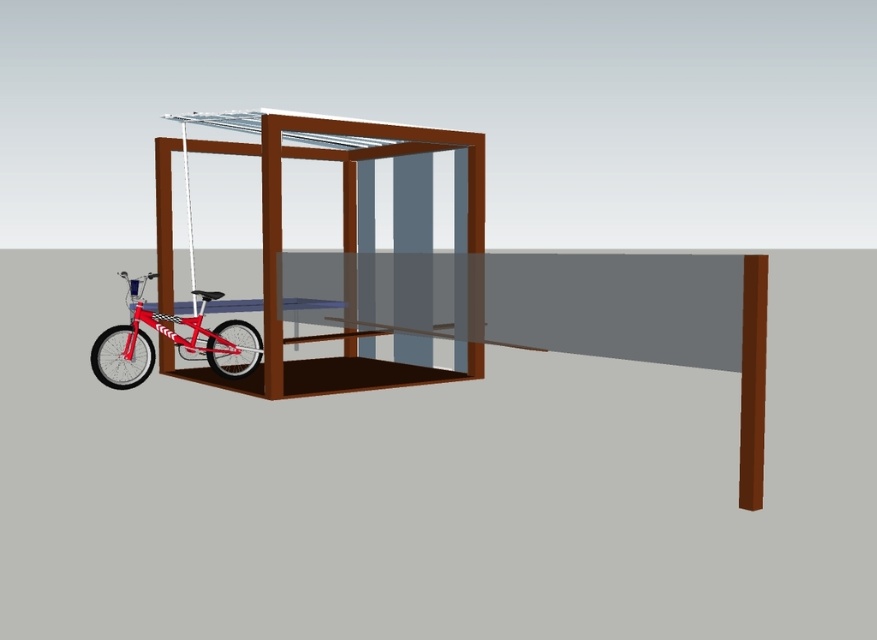
Question: In this image, where is brown matte gazebo at left located relative to shiny red bicycle at left?

Choices:
 (A) below
 (B) above

Answer: (B)

Question: Observing the image, what is the correct spatial positioning of brown matte gazebo at left in reference to shiny red bicycle at left?

Choices:
 (A) above
 (B) below

Answer: (A)

Question: Among these points, which one is farthest from the camera?

Choices:
 (A) (157, 314)
 (B) (168, 349)

Answer: (B)

Question: Is brown matte gazebo at left to the right of shiny red bicycle at left from the viewer's perspective?

Choices:
 (A) no
 (B) yes

Answer: (B)